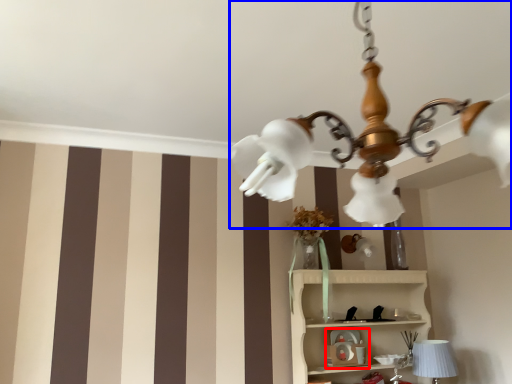
Question: Among these objects, which one is farthest to the camera, toy (highlighted by a red box) or lamp (highlighted by a blue box)?

Choices:
 (A) toy
 (B) lamp

Answer: (A)